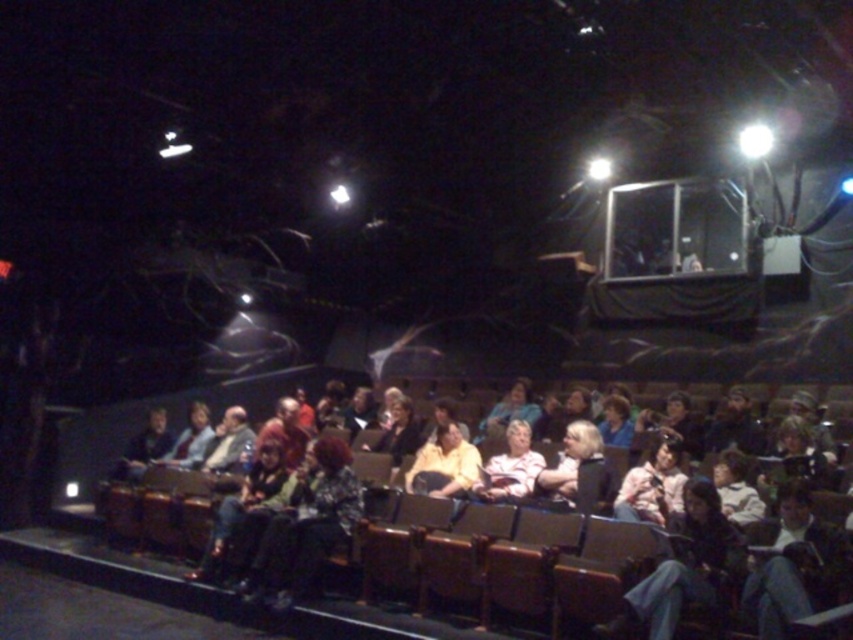
Question: Estimate the real-world distances between objects in this image. Which object is closer to the matte yellow shirt at center?

Choices:
 (A) camouflage-patterned jacket at center
 (B) light blue fabric jacket at center
 (C) striped fabric shirt at center

Answer: (C)

Question: Which object is the closest to the matte yellow shirt at center?

Choices:
 (A) light blue fabric jacket at center
 (B) camouflage-patterned jacket at center

Answer: (B)

Question: Is camouflage-patterned jacket at center further to camera compared to light blue fabric jacket at center?

Choices:
 (A) yes
 (B) no

Answer: (B)

Question: Is matte yellow shirt at center behind light blue fabric jacket at center?

Choices:
 (A) no
 (B) yes

Answer: (A)

Question: Is matte yellow shirt at center below camouflage-patterned jacket at center?

Choices:
 (A) yes
 (B) no

Answer: (B)

Question: Which of these objects is positioned farthest from the light blue fabric jacket at center?

Choices:
 (A) striped fabric shirt at center
 (B) matte yellow shirt at center

Answer: (B)